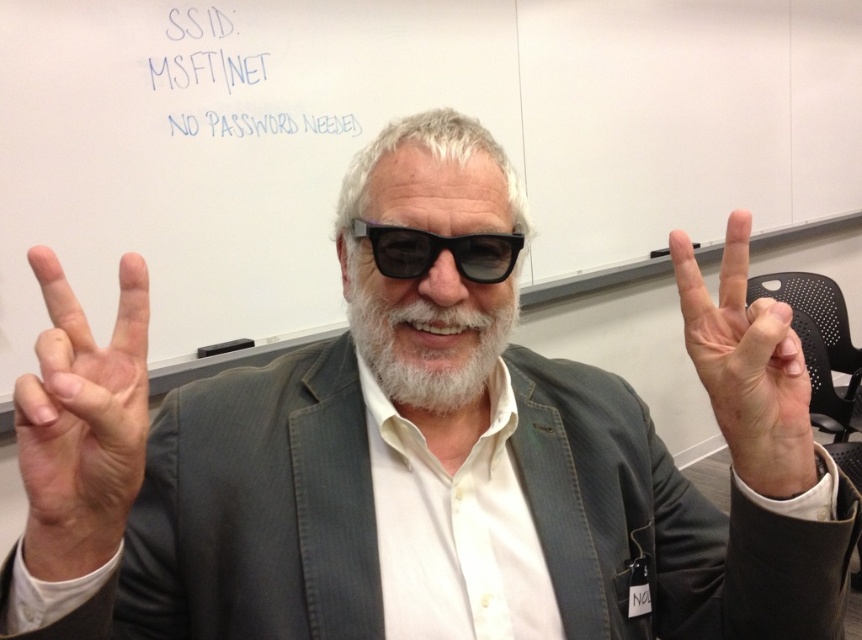
Which is more to the right, whitewool-likebeard at center or black matte glasses at center?

whitewool-likebeard at center is more to the right.

Between point (357, 323) and point (486, 280), which one is positioned in front?

Point (486, 280) is more forward.

Image resolution: width=862 pixels, height=640 pixels. I want to click on whitewool-likebeard at center, so click(426, 346).

Is point (329, 109) positioned behind point (464, 394)?

Yes.

What do you see at coordinates (247, 77) in the screenshot? I see `blue ink writing at upper left` at bounding box center [247, 77].

At what (x,y) coordinates should I click in order to perform the action: click on blue ink writing at upper left. Please return your answer as a coordinate pair (x, y). Looking at the image, I should click on (247, 77).

Image resolution: width=862 pixels, height=640 pixels. What do you see at coordinates (747, 365) in the screenshot?
I see `pink flesh at center` at bounding box center [747, 365].

Between pink flesh at center and blue ink writing at upper left, which one is positioned higher?

blue ink writing at upper left is above.

Which is in front, point (785, 376) or point (269, 74)?

Point (785, 376)

I want to click on pink flesh at center, so click(747, 365).